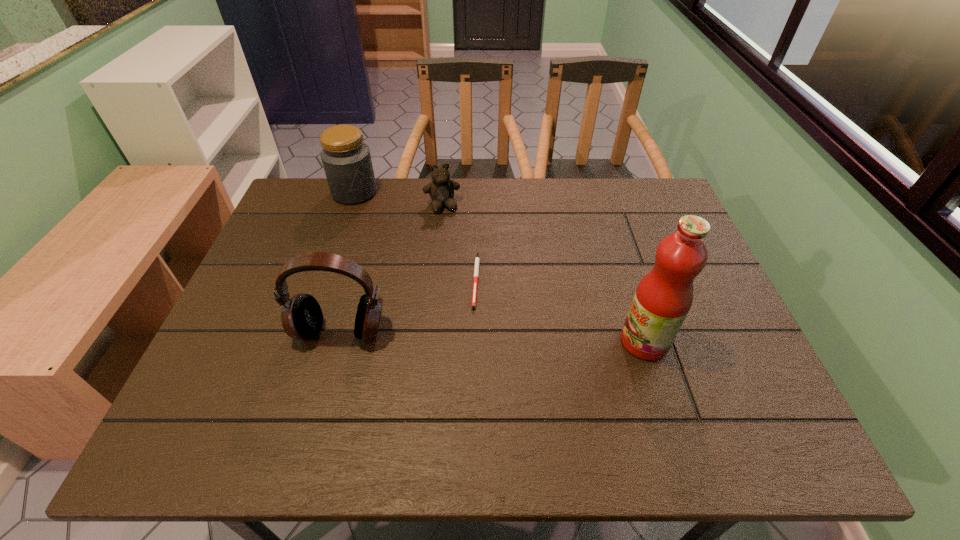
Locate an element on the screen. The image size is (960, 540). object that stands as the closest to the jar is located at coordinates (441, 190).

The width and height of the screenshot is (960, 540). What are the coordinates of `free spot that satisfies the following two spatial constraints: 1. on the front side of the fruit juice; 2. on the front label of the teddy bear` in the screenshot? It's located at (429, 341).

At what (x,y) coordinates should I click in order to perform the action: click on free space that satisfies the following two spatial constraints: 1. on the front side of the jar; 2. on the left side of the third object from right to left. Please return your answer as a coordinate pair (x, y). This screenshot has width=960, height=540. Looking at the image, I should click on pos(350,205).

In order to click on vacant area in the image that satisfies the following two spatial constraints: 1. on the front side of the jar; 2. on the left side of the third object from left to right in this screenshot , I will do point(350,205).

The image size is (960, 540). I want to click on vacant region that satisfies the following two spatial constraints: 1. on the front side of the tallest object; 2. on the front label of the pen, so click(x=475, y=341).

This screenshot has width=960, height=540. Identify the location of free space that satisfies the following two spatial constraints: 1. on the ear pads of the headset; 2. on the front label of the tallest object. (338, 341).